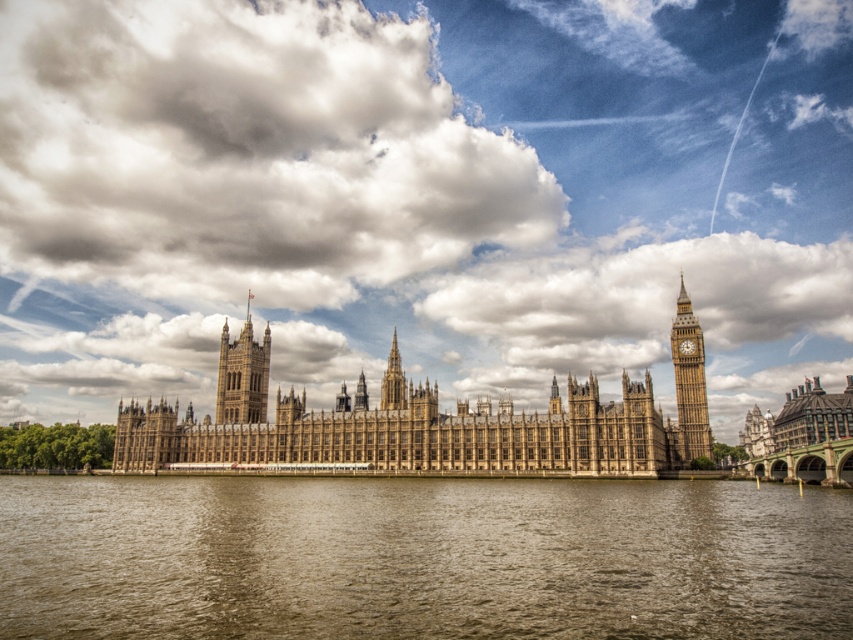
Question: Which point is closer to the camera taking this photo?

Choices:
 (A) click(x=683, y=406)
 (B) click(x=535, y=426)

Answer: (B)

Question: Where is golden stone clock tower at right located in relation to brown stone tower at center in the image?

Choices:
 (A) below
 (B) above

Answer: (B)

Question: Which of the following is the closest to the observer?

Choices:
 (A) golden stone clock tower at right
 (B) brown stone tower at center

Answer: (A)

Question: Considering the relative positions of brown stone castle at center and golden stone clock tower at right in the image provided, where is brown stone castle at center located with respect to golden stone clock tower at right?

Choices:
 (A) below
 (B) above

Answer: (A)

Question: Which object is farther from the camera taking this photo?

Choices:
 (A) brown stone castle at center
 (B) brown stone tower at center
 (C) cloudy sky at upper center

Answer: (C)

Question: Does brown water at lower center have a greater width compared to brown stone castle at center?

Choices:
 (A) yes
 (B) no

Answer: (B)